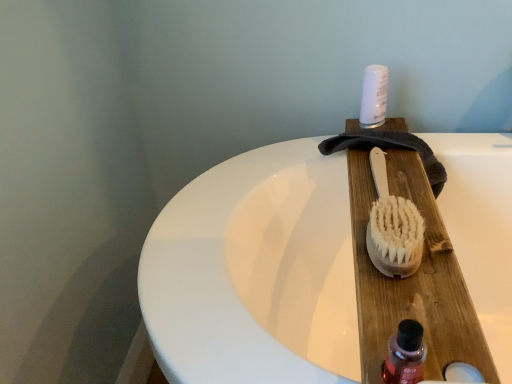
Describe the element at coordinates (393, 227) in the screenshot. I see `natural wood brush at center` at that location.

At what (x,y) coordinates should I click in order to perform the action: click on white plastic canister at upper center. Please return your answer as a coordinate pair (x, y). This screenshot has height=384, width=512. Looking at the image, I should click on (374, 96).

Between white plastic canister at upper center and natural wood brush at center, which one has less height?

With less height is natural wood brush at center.

Is white plastic canister at upper center with natural wood brush at center?

There is a gap between white plastic canister at upper center and natural wood brush at center.

Is white plastic canister at upper center positioned with its back to natural wood brush at center?

No, white plastic canister at upper center's orientation is not away from natural wood brush at center.

Measure the distance between white plastic canister at upper center and natural wood brush at center.

white plastic canister at upper center and natural wood brush at center are 10.43 inches apart.

Does translucent plastic bottle at lower right have a lesser height compared to natural wood brush at center?

No.

Does translucent plastic bottle at lower right appear on the right side of natural wood brush at center?

Incorrect, translucent plastic bottle at lower right is not on the right side of natural wood brush at center.

Can you tell me how much translucent plastic bottle at lower right and natural wood brush at center differ in facing direction?

The angle between the facing direction of translucent plastic bottle at lower right and the facing direction of natural wood brush at center is 0.00122 degrees.

In the scene shown: From the image's perspective, is translucent plastic bottle at lower right located above or below natural wood brush at center?

Clearly, from the image's perspective, translucent plastic bottle at lower right is below natural wood brush at center.

Considering the relative sizes of translucent plastic bottle at lower right and white plastic canister at upper center in the image provided, is translucent plastic bottle at lower right thinner than white plastic canister at upper center?

Indeed, translucent plastic bottle at lower right has a lesser width compared to white plastic canister at upper center.

Who is smaller, translucent plastic bottle at lower right or white plastic canister at upper center?

translucent plastic bottle at lower right is smaller.

Are translucent plastic bottle at lower right and white plastic canister at upper center far apart?

Actually, translucent plastic bottle at lower right and white plastic canister at upper center are a little close together.

I want to click on toiletry located behind the translucent plastic bottle at lower right, so click(x=374, y=96).

Which object is wider, natural wood brush at center or translucent plastic bottle at lower right?

natural wood brush at center is wider.

Measure the distance between natural wood brush at center and translucent plastic bottle at lower right.

A distance of 18.29 centimeters exists between natural wood brush at center and translucent plastic bottle at lower right.

What's the angular difference between natural wood brush at center and translucent plastic bottle at lower right's facing directions?

0.00122 degrees.

Which of these two, natural wood brush at center or translucent plastic bottle at lower right, stands taller?

translucent plastic bottle at lower right is taller.

Based on the photo, which object is further away from the camera, natural wood brush at center or white plastic canister at upper center?

white plastic canister at upper center.

Is natural wood brush at center shorter than white plastic canister at upper center?

Yes, natural wood brush at center is shorter than white plastic canister at upper center.

Is there a large distance between natural wood brush at center and white plastic canister at upper center?

No, there isn't a large distance between natural wood brush at center and white plastic canister at upper center.

Can you confirm if natural wood brush at center is thinner than white plastic canister at upper center?

Incorrect, the width of natural wood brush at center is not less than that of white plastic canister at upper center.

Can you confirm if white plastic canister at upper center is positioned to the right of translucent plastic bottle at lower right?

Indeed, white plastic canister at upper center is positioned on the right side of translucent plastic bottle at lower right.

How different are the orientations of white plastic canister at upper center and translucent plastic bottle at lower right in degrees?

0.000907 degrees.

From the image's perspective, is white plastic canister at upper center under translucent plastic bottle at lower right?

No.

Does white plastic canister at upper center have a larger size compared to translucent plastic bottle at lower right?

Yes.

Where is `toiletry behind the natural wood brush at center`? toiletry behind the natural wood brush at center is located at coordinates (374, 96).

Identify the location of bottle located above the natural wood brush at center (from a real-world perspective). This screenshot has width=512, height=384. (405, 354).

From the picture: Which object lies nearer to the anchor point natural wood brush at center, white plastic canister at upper center or translucent plastic bottle at lower right?

Among the two, translucent plastic bottle at lower right is located nearer to natural wood brush at center.

Which object lies nearer to the anchor point white plastic canister at upper center, natural wood brush at center or translucent plastic bottle at lower right?

Among the two, natural wood brush at center is located nearer to white plastic canister at upper center.

Looking at the image, which one is located further to translucent plastic bottle at lower right, natural wood brush at center or white plastic canister at upper center?

white plastic canister at upper center.

Consider the image. When comparing their distances from white plastic canister at upper center, does translucent plastic bottle at lower right or natural wood brush at center seem closer?

natural wood brush at center is closer to white plastic canister at upper center.

Looking at the image, which one is located closer to translucent plastic bottle at lower right, white plastic canister at upper center or natural wood brush at center?

Among the two, natural wood brush at center is located nearer to translucent plastic bottle at lower right.

Estimate the real-world distances between objects in this image. Which object is further from natural wood brush at center, translucent plastic bottle at lower right or white plastic canister at upper center?

white plastic canister at upper center is positioned further to the anchor natural wood brush at center.

At what (x,y) coordinates should I click in order to perform the action: click on brush positioned between translucent plastic bottle at lower right and white plastic canister at upper center from near to far. Please return your answer as a coordinate pair (x, y). This screenshot has height=384, width=512. Looking at the image, I should click on (393, 227).